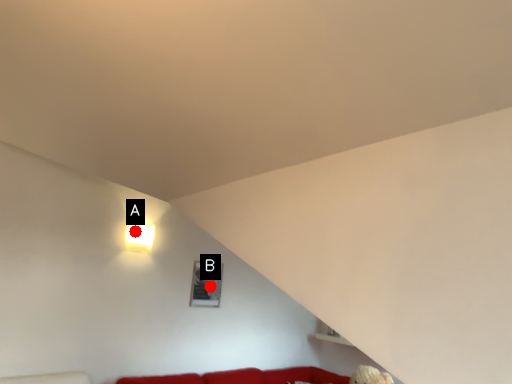
Question: Two points are circled on the image, labeled by A and B beside each circle. Which point appears farthest from the camera in this image?

Choices:
 (A) A is further
 (B) B is further

Answer: (B)